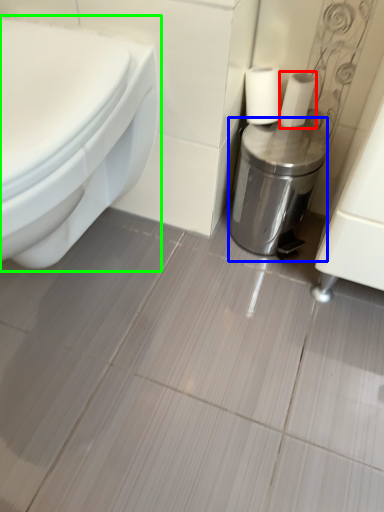
Question: Based on their relative distances, which object is nearer to toilet paper (highlighted by a red box)? Choose from dispenser (highlighted by a blue box) and toilet (highlighted by a green box).

Choices:
 (A) dispenser
 (B) toilet

Answer: (A)